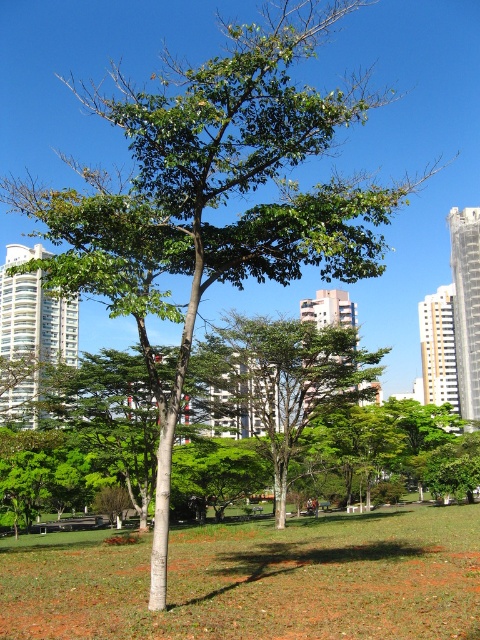
Question: Can you confirm if green grass at center is positioned to the right of green leafy tree at center?

Choices:
 (A) no
 (B) yes

Answer: (A)

Question: In this image, where is green grass at center located relative to green leafy tree at center?

Choices:
 (A) right
 (B) left

Answer: (B)

Question: Does green grass at center lie behind green leafy tree at center?

Choices:
 (A) yes
 (B) no

Answer: (B)